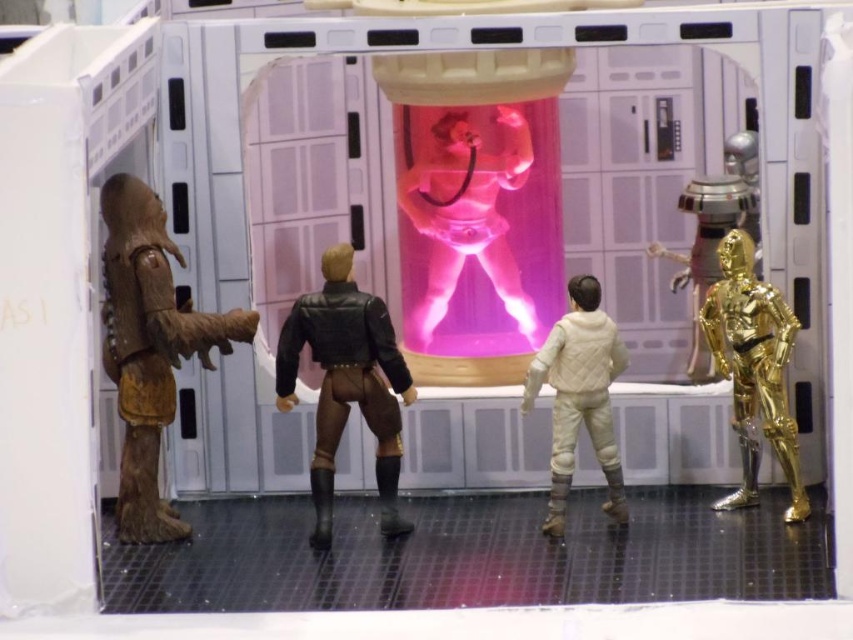
You are a GUI agent. You are given a task and a screenshot of the screen. Output one action in this format:
    pyautogui.click(x=<x>, y=<y>)
    Task: Click on the pink translucent figure at center
    This screenshot has height=640, width=853.
    Given the screenshot: What is the action you would take?
    pyautogui.click(x=460, y=212)

Does point (415, 122) lie behind point (175, 368)?

Yes, point (415, 122) is farther from viewer.

Identify the location of pink translucent figure at center. The height and width of the screenshot is (640, 853). (460, 212).

Can you confirm if leather jacket at center is taller than gold metallic robot at right?

Yes.

Looking at this image, between leather jacket at center and gold metallic robot at right, which one has more height?

leather jacket at center is taller.

This screenshot has width=853, height=640. What do you see at coordinates (346, 384) in the screenshot?
I see `leather jacket at center` at bounding box center [346, 384].

Where is `leather jacket at center`? The image size is (853, 640). leather jacket at center is located at coordinates (346, 384).

Image resolution: width=853 pixels, height=640 pixels. Describe the element at coordinates (753, 368) in the screenshot. I see `gold metallic robot at right` at that location.

The width and height of the screenshot is (853, 640). I want to click on gold metallic robot at right, so click(x=753, y=368).

Identify the location of gold metallic robot at right. The width and height of the screenshot is (853, 640). (753, 368).